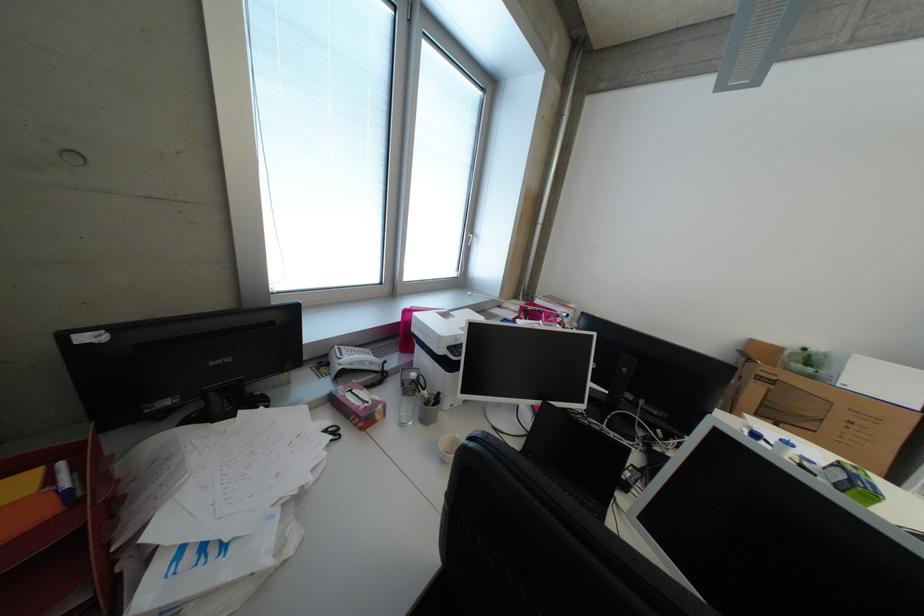
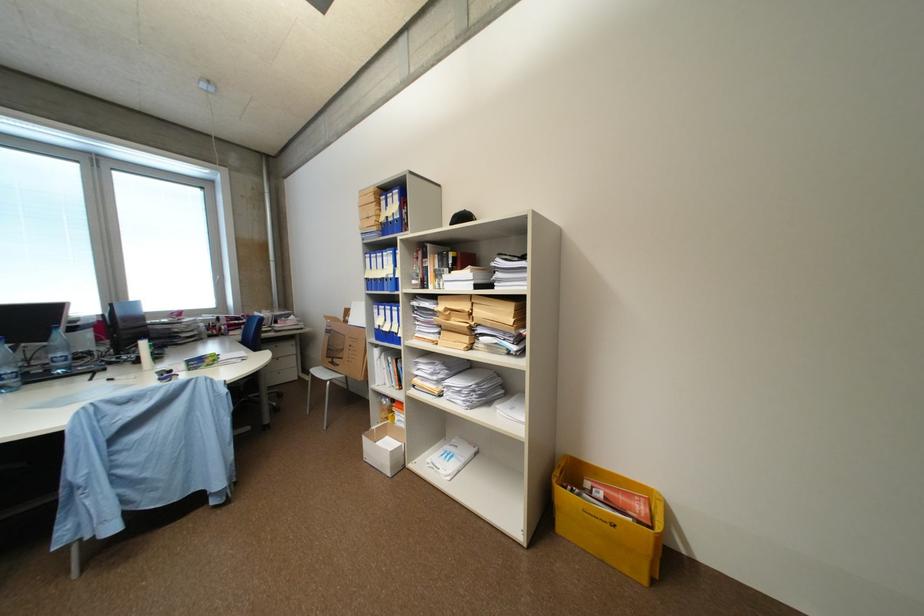
Question: I am providing you with two images of the same scene from different viewpoints. After the viewpoint changes to image2, which objects are now occluded?

Choices:
 (A) white cardboard box
 (B) blue binder handle
 (C) yellow mail bin
 (D) none of these

Answer: (D)